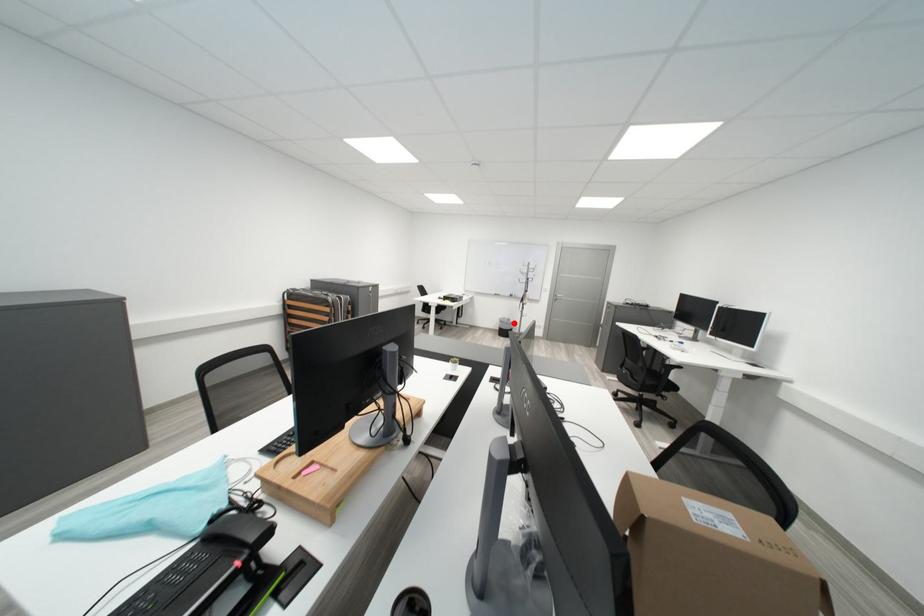
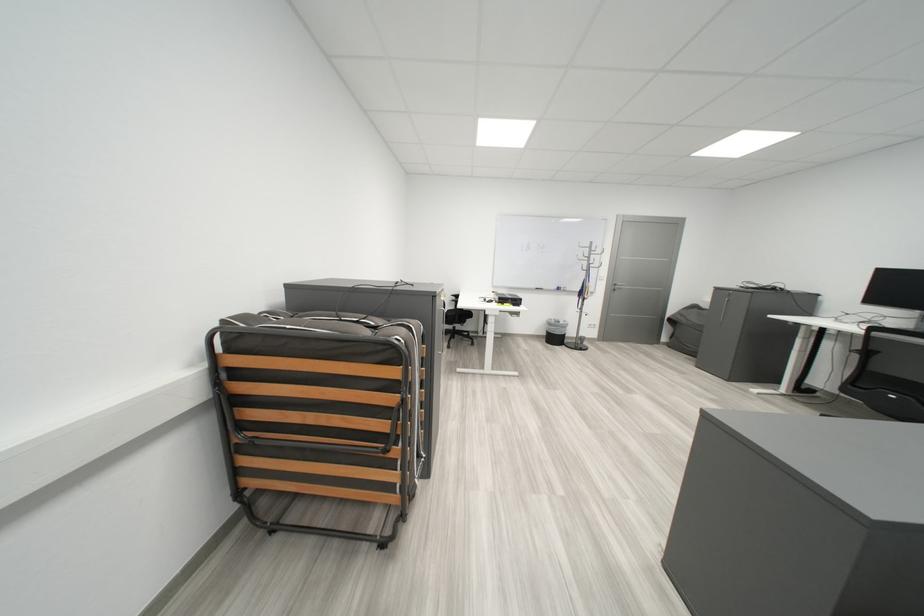
Question: I am providing you with two images of the same scene from different viewpoints. Given a red point in image1, look at the same physical point in image2. Is it:

Choices:
 (A) Closer to the viewpoint
 (B) Farther from the viewpoint

Answer: (B)